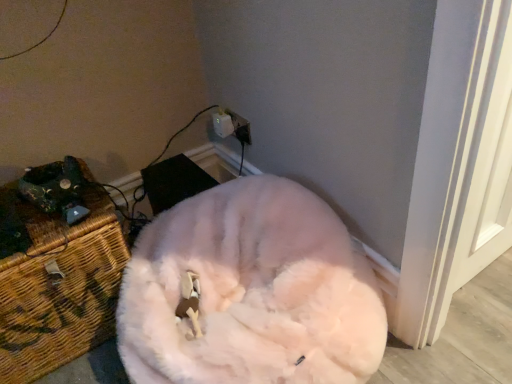
Question: Is woven wicker chest at left positioned with its back to white fluffy cat at center?

Choices:
 (A) yes
 (B) no

Answer: (B)

Question: Does woven wicker chest at left appear on the right side of white fluffy cat at center?

Choices:
 (A) yes
 (B) no

Answer: (B)

Question: Does woven wicker chest at left have a lesser width compared to white fluffy cat at center?

Choices:
 (A) no
 (B) yes

Answer: (B)

Question: Does woven wicker chest at left contain white fluffy cat at center?

Choices:
 (A) yes
 (B) no

Answer: (B)

Question: Can you confirm if woven wicker chest at left is smaller than white fluffy cat at center?

Choices:
 (A) no
 (B) yes

Answer: (B)

Question: From the image's perspective, relative to white fluffy cat at center, is white plastic electric outlet at upper center above or below?

Choices:
 (A) below
 (B) above

Answer: (B)

Question: Considering the relative positions of white plastic electric outlet at upper center and white fluffy cat at center in the image provided, is white plastic electric outlet at upper center to the left or to the right of white fluffy cat at center?

Choices:
 (A) right
 (B) left

Answer: (B)

Question: From a real-world perspective, is white plastic electric outlet at upper center positioned above or below white fluffy cat at center?

Choices:
 (A) below
 (B) above

Answer: (B)

Question: Looking at their shapes, would you say white plastic electric outlet at upper center is wider or thinner than white fluffy cat at center?

Choices:
 (A) thin
 (B) wide

Answer: (A)

Question: In terms of size, does white fluffy cat at center appear bigger or smaller than white plastic electric outlet at upper center?

Choices:
 (A) big
 (B) small

Answer: (A)

Question: Considering the positions of white fluffy cat at center and white plastic electric outlet at upper center in the image, is white fluffy cat at center wider or thinner than white plastic electric outlet at upper center?

Choices:
 (A) thin
 (B) wide

Answer: (B)

Question: Is point coord(189,203) closer or farther from the camera than point coord(219,110)?

Choices:
 (A) closer
 (B) farther

Answer: (A)

Question: Do you think white fluffy cat at center is within white plastic electric outlet at upper center, or outside of it?

Choices:
 (A) outside
 (B) inside

Answer: (A)

Question: From a real-world perspective, is white fluffy cat at center above or below woven wicker chest at left?

Choices:
 (A) below
 (B) above

Answer: (A)

Question: Considering their positions, is white fluffy cat at center located in front of or behind woven wicker chest at left?

Choices:
 (A) behind
 (B) front

Answer: (B)